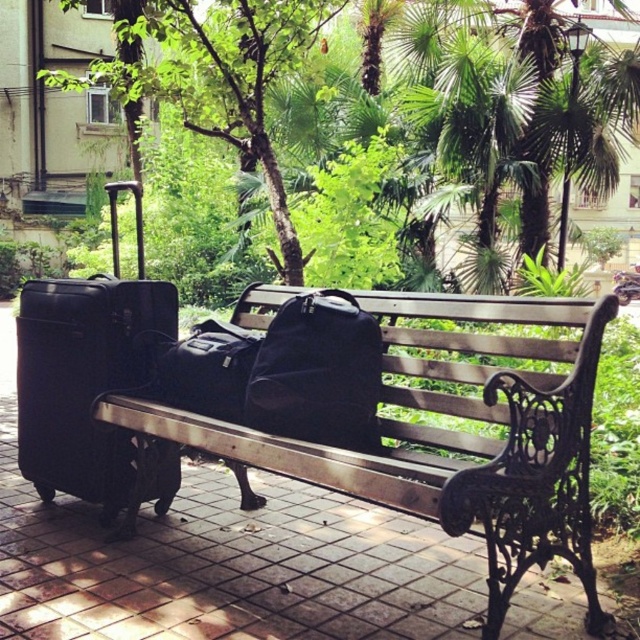
You are a delivery person trying to place a new bag that is 24 inches long between the black matte suitcase at left and the matte black duffel bag at center. Based on the scene, will the space between them be sufficient to fit the new bag?

The distance between the black matte suitcase at left and the matte black duffel bag at center is 22.44 inches, which is shorter than the 24 inches required for the new bag. Therefore, the space is insufficient to accommodate the new bag.

You are standing at the edge of the paved area and want to place a new small potted plant between the green leafy tree at upper center and the matte black duffel bag at center. Based on their sizes, will there be enough space for the plant?

The green leafy tree at upper center might be wider than the matte black duffel bag at center, so there could be sufficient space between them to place a small potted plant.